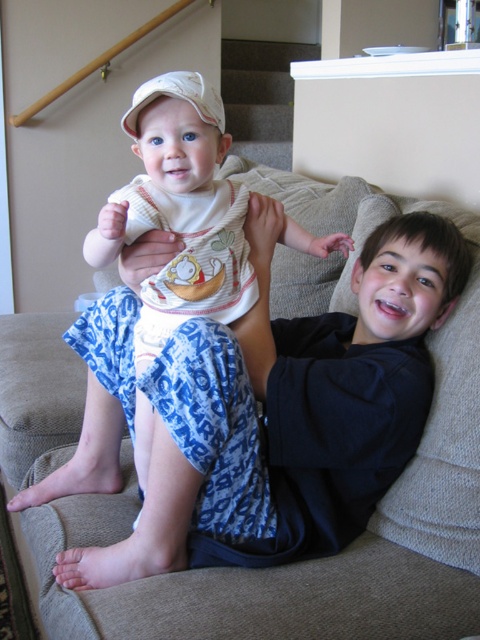
Does point (365, 333) come in front of point (175, 115)?

No, it is behind (175, 115).

Is blue cotton pajama pants at center below white cotton onesie at center?

Indeed, blue cotton pajama pants at center is positioned under white cotton onesie at center.

Describe the element at coordinates (294, 401) in the screenshot. I see `blue cotton pajama pants at center` at that location.

Locate an element on the screen. This screenshot has height=640, width=480. blue cotton pajama pants at center is located at coordinates (294, 401).